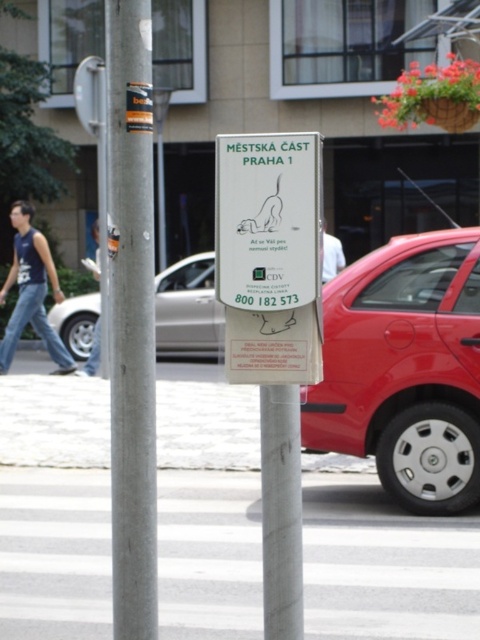
You are a tourist in Prague and see the white paper sign at center. What is the main message about dog tethering according to the sign?

The sign states that your dog does not need to be tethered, as indicated by the text on the white paper sign at center.

What is the position of the metallic red car at right relative to the silver metallic pole at left?

The metallic red car at right is positioned below the silver metallic pole at left.